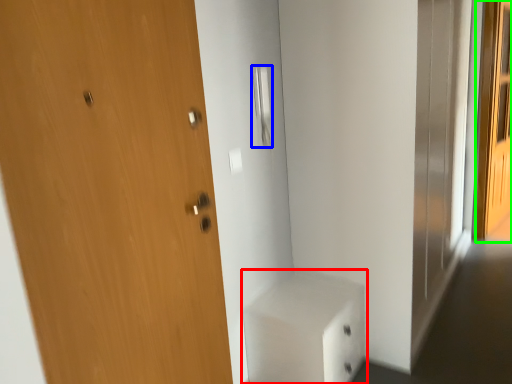
Question: Considering the real-world distances, which object is farthest from cabinetry (highlighted by a red box)? door handle (highlighted by a blue box) or screen door (highlighted by a green box)?

Choices:
 (A) door handle
 (B) screen door

Answer: (B)